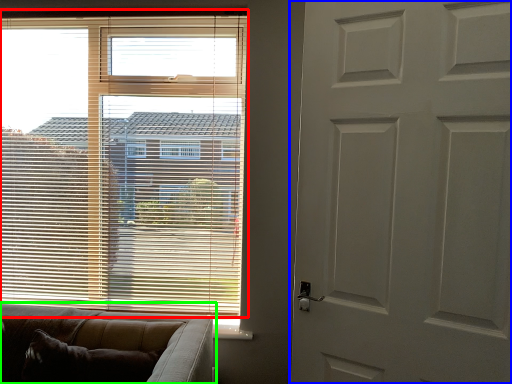
Question: Which is nearer to the window blind (highlighted by a red box)? door (highlighted by a blue box) or studio couch (highlighted by a green box).

Choices:
 (A) door
 (B) studio couch

Answer: (B)